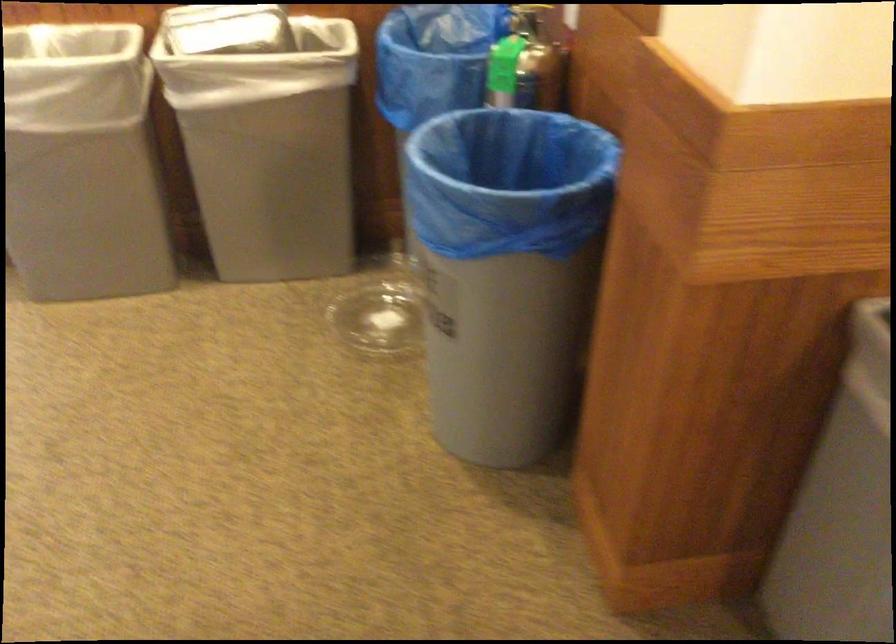
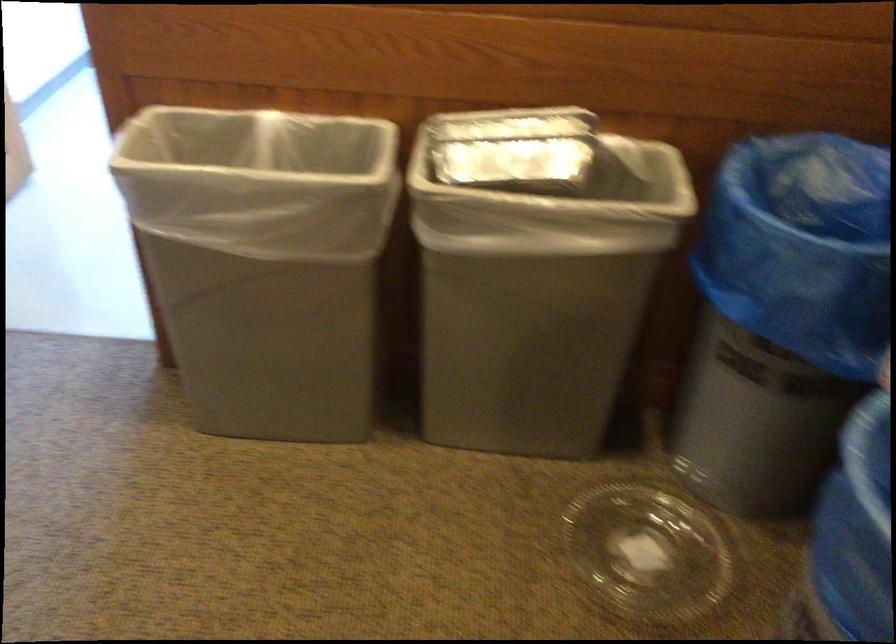
Find the pixel in the second image that matches (390,315) in the first image.

(648, 552)